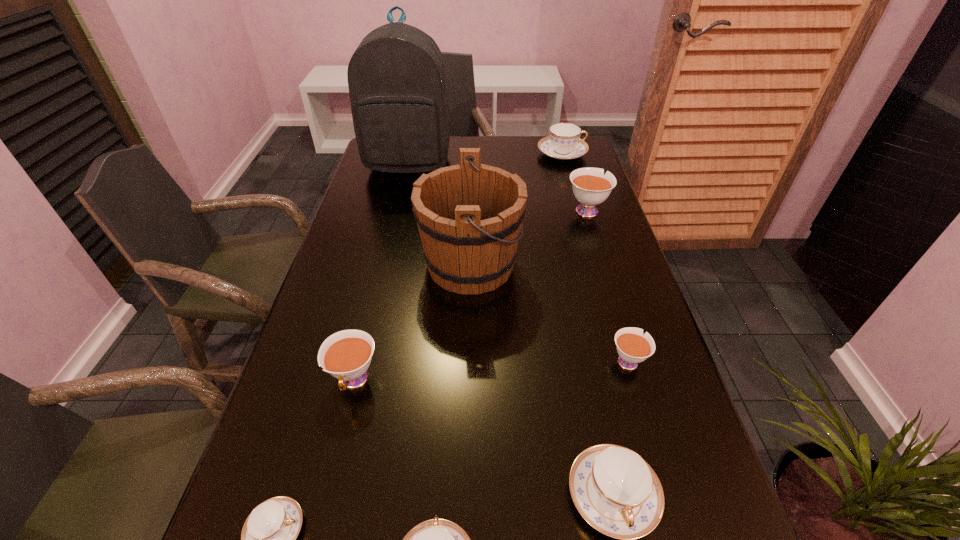
Where is `vacant position located 0.210m on the front-facing side of the backpack`? This screenshot has height=540, width=960. vacant position located 0.210m on the front-facing side of the backpack is located at coordinates (396, 217).

You are a GUI agent. You are given a task and a screenshot of the screen. Output one action in this format:
    pyautogui.click(x=<x>, y=<y>)
    Task: Click on the vacant space situated on the side of the eighth shortest object with the handle for carrying
    
    Given the screenshot: What is the action you would take?
    pyautogui.click(x=555, y=265)

You are a GUI agent. You are given a task and a screenshot of the screen. Output one action in this format:
    pyautogui.click(x=<x>, y=<y>)
    Task: Click on the free location located on the side of the tallest teacup with the handle
    
    Given the screenshot: What is the action you would take?
    pyautogui.click(x=564, y=139)

Identify the location of vacant area located 0.120m on the side of the tallest teacup with the handle. The height and width of the screenshot is (540, 960). (576, 177).

At what (x,y) coordinates should I click in order to perform the action: click on vacant space situated on the side of the tallest teacup with the handle. Please return your answer as a coordinate pair (x, y). Looking at the image, I should click on (571, 160).

The image size is (960, 540). What are the coordinates of `free location located 0.080m on the side of the leftmost white teacup with the handle` in the screenshot? It's located at click(338, 447).

Locate an element on the screen. The height and width of the screenshot is (540, 960). vacant point located 0.350m on the side of the smallest white teacup with the handle is located at coordinates (592, 243).

The image size is (960, 540). Find the location of `free region located 0.230m on the side of the smallest white teacup with the handle`. free region located 0.230m on the side of the smallest white teacup with the handle is located at coordinates (601, 272).

Find the location of a particular element. Image resolution: width=960 pixels, height=540 pixels. free space located 0.210m on the side of the smallest white teacup with the handle is located at coordinates (603, 278).

Locate an element on the screen. This screenshot has height=540, width=960. backpack at the far edge is located at coordinates (396, 77).